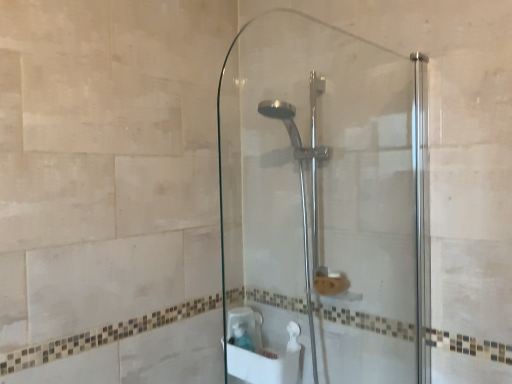
Describe the element at coordinates (323, 207) in the screenshot. I see `transparent glass shower door at center` at that location.

Locate an element on the screen. transparent glass shower door at center is located at coordinates (323, 207).

The width and height of the screenshot is (512, 384). What do you see at coordinates (301, 193) in the screenshot?
I see `polished chrome shower head at center` at bounding box center [301, 193].

Where is `polished chrome shower head at center`? This screenshot has height=384, width=512. polished chrome shower head at center is located at coordinates (301, 193).

Image resolution: width=512 pixels, height=384 pixels. I want to click on transparent glass shower door at center, so (323, 207).

Would you say transparent glass shower door at center is to the left or to the right of polished chrome shower head at center in the picture?

Based on their positions, transparent glass shower door at center is located to the right of polished chrome shower head at center.

Which is in front, transparent glass shower door at center or polished chrome shower head at center?

transparent glass shower door at center is in front.

Which is behind, point (375, 346) or point (315, 363)?

Point (315, 363)

From the image's perspective, is transparent glass shower door at center beneath polished chrome shower head at center?

No.

From a real-world perspective, which is physically above, transparent glass shower door at center or polished chrome shower head at center?

transparent glass shower door at center.

In terms of width, does transparent glass shower door at center look wider or thinner when compared to polished chrome shower head at center?

In the image, transparent glass shower door at center appears to be more narrow than polished chrome shower head at center.

Considering the sizes of objects transparent glass shower door at center and polished chrome shower head at center in the image provided, who is taller, transparent glass shower door at center or polished chrome shower head at center?

Standing taller between the two is polished chrome shower head at center.

In terms of size, does transparent glass shower door at center appear bigger or smaller than polished chrome shower head at center?

transparent glass shower door at center is smaller than polished chrome shower head at center.

Could polished chrome shower head at center be considered to be inside transparent glass shower door at center?

Actually, polished chrome shower head at center is outside transparent glass shower door at center.

Is transparent glass shower door at center far away from polished chrome shower head at center?

No, transparent glass shower door at center is not far away from polished chrome shower head at center.

Is polished chrome shower head at center at the back of transparent glass shower door at center?

Yes, transparent glass shower door at center is positioned with its back facing polished chrome shower head at center.

Can you tell me how much transparent glass shower door at center and polished chrome shower head at center differ in facing direction?

The facing directions of transparent glass shower door at center and polished chrome shower head at center are 89.9 degrees apart.

How far apart are transparent glass shower door at center and polished chrome shower head at center?

transparent glass shower door at center and polished chrome shower head at center are 6.46 inches apart.

Find the location of a particular element. The height and width of the screenshot is (384, 512). screen door above the polished chrome shower head at center (from a real-world perspective) is located at coordinates (323, 207).

Consider the image. Would you say polished chrome shower head at center is to the left or to the right of transparent glass shower door at center in the picture?

polished chrome shower head at center is to the left of transparent glass shower door at center.

Based on the photo, which is in front, polished chrome shower head at center or transparent glass shower door at center?

transparent glass shower door at center is in front.

Is point (276, 111) farther from viewer compared to point (293, 230)?

No, (276, 111) is in front of (293, 230).

From the image's perspective, is polished chrome shower head at center located above transparent glass shower door at center?

No, from the image's perspective, polished chrome shower head at center is not on top of transparent glass shower door at center.

From a real-world perspective, which object stands above the other?

From a 3D spatial view, transparent glass shower door at center is above.

Can you confirm if polished chrome shower head at center is thinner than transparent glass shower door at center?

In fact, polished chrome shower head at center might be wider than transparent glass shower door at center.

Between polished chrome shower head at center and transparent glass shower door at center, which one has less height?

transparent glass shower door at center is shorter.

Between polished chrome shower head at center and transparent glass shower door at center, which one has smaller size?

transparent glass shower door at center.

Is polished chrome shower head at center completely or partially outside of transparent glass shower door at center?

Yes, polished chrome shower head at center is outside of transparent glass shower door at center.

Is polished chrome shower head at center not near transparent glass shower door at center?

That's not correct — polished chrome shower head at center is a little close to transparent glass shower door at center.

Is polished chrome shower head at center aimed at transparent glass shower door at center?

No, polished chrome shower head at center is not turned towards transparent glass shower door at center.

Could you measure the distance between polished chrome shower head at center and transparent glass shower door at center?

polished chrome shower head at center and transparent glass shower door at center are 6.46 inches apart.

Find the location of a particular element. shower beneath the transparent glass shower door at center (from a real-world perspective) is located at coordinates (301, 193).

Locate an element on the screen. Image resolution: width=512 pixels, height=384 pixels. shower below the transparent glass shower door at center (from a real-world perspective) is located at coordinates (301, 193).

At what (x,y) coordinates should I click in order to perform the action: click on screen door that appears on the right of polished chrome shower head at center. Please return your answer as a coordinate pair (x, y). Looking at the image, I should click on (323, 207).